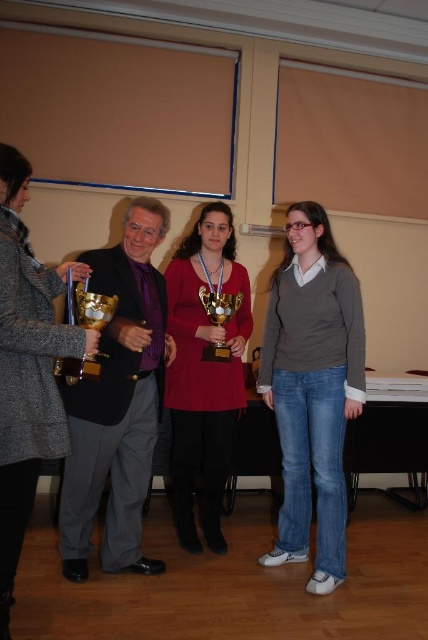
Question: Can you confirm if gray wool coat at left is positioned above matte gold trophy at center?

Choices:
 (A) no
 (B) yes

Answer: (B)

Question: Among these points, which one is nearest to the camera?

Choices:
 (A) (35, 426)
 (B) (148, 394)
 (C) (199, 460)

Answer: (A)

Question: Does shiny black suit at center appear over gold shiny trophy at left?

Choices:
 (A) no
 (B) yes

Answer: (A)

Question: Which point appears farthest from the camera in this image?

Choices:
 (A) (x=291, y=326)
 (B) (x=88, y=465)

Answer: (A)

Question: Is gold shiny trophy at left positioned before gold shiny trophy at center?

Choices:
 (A) no
 (B) yes

Answer: (B)

Question: Which point is farther to the camera?

Choices:
 (A) (128, 241)
 (B) (205, 355)

Answer: (B)